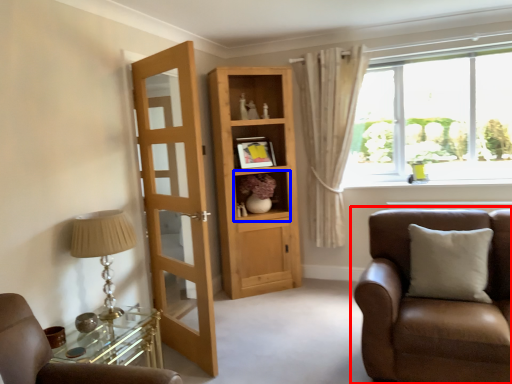
Question: Among these objects, which one is nearest to the camera, chair (highlighted by a red box) or cabinet (highlighted by a blue box)?

Choices:
 (A) chair
 (B) cabinet

Answer: (A)